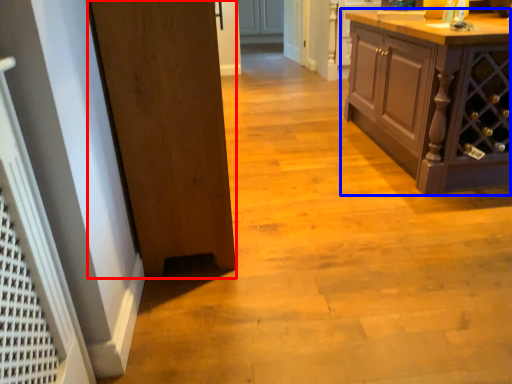
Question: Which point is further to the camera, door (highlighted by a red box) or cabinetry (highlighted by a blue box)?

Choices:
 (A) door
 (B) cabinetry

Answer: (B)